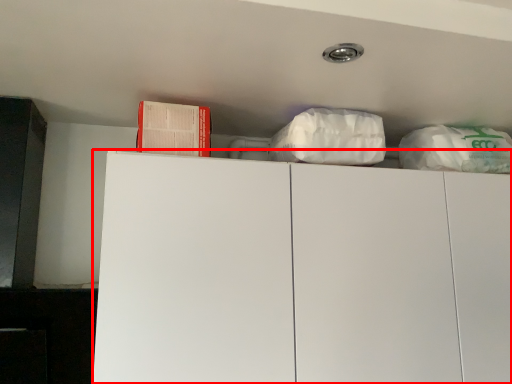
Question: In this image, where is cabinetry (annotated by the red box) located relative to book?

Choices:
 (A) left
 (B) right

Answer: (B)